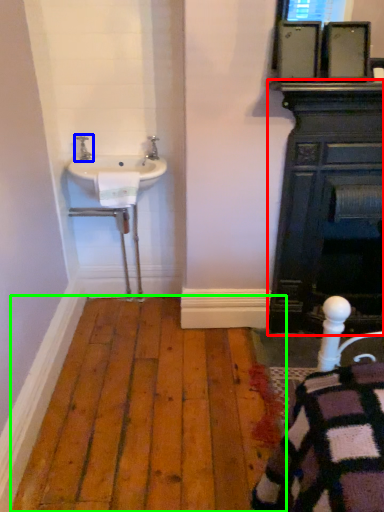
Question: Which object is the farthest from bathroom cabinet (highlighted by a red box)? Choose among these: tap (highlighted by a blue box) or hardwood (highlighted by a green box).

Choices:
 (A) tap
 (B) hardwood

Answer: (A)